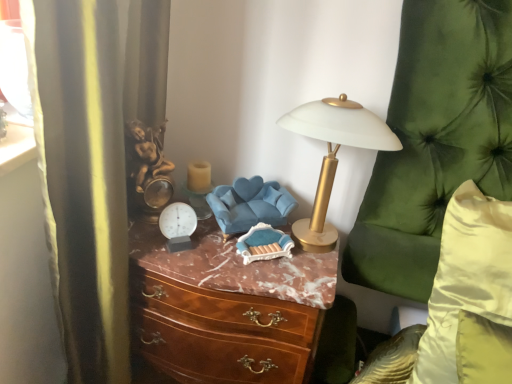
Question: Looking at their shapes, would you say translucent glass candle at center is wider or thinner than silky yellow pillow at right?

Choices:
 (A) wide
 (B) thin

Answer: (B)

Question: In the image, is translucent glass candle at center positioned in front of or behind silky yellow pillow at right?

Choices:
 (A) behind
 (B) front

Answer: (A)

Question: Which object is the closest to the blue fabric swivel chair at center?

Choices:
 (A) marble/wooden chest of drawers at center
 (B) silky yellow pillow at right
 (C) gold metallic table lamp at upper center
 (D) translucent glass candle at center

Answer: (D)

Question: Based on their relative distances, which object is farther from the blue fabric swivel chair at center?

Choices:
 (A) marble/wooden chest of drawers at center
 (B) silky yellow pillow at right
 (C) gold metallic table lamp at upper center
 (D) translucent glass candle at center

Answer: (B)